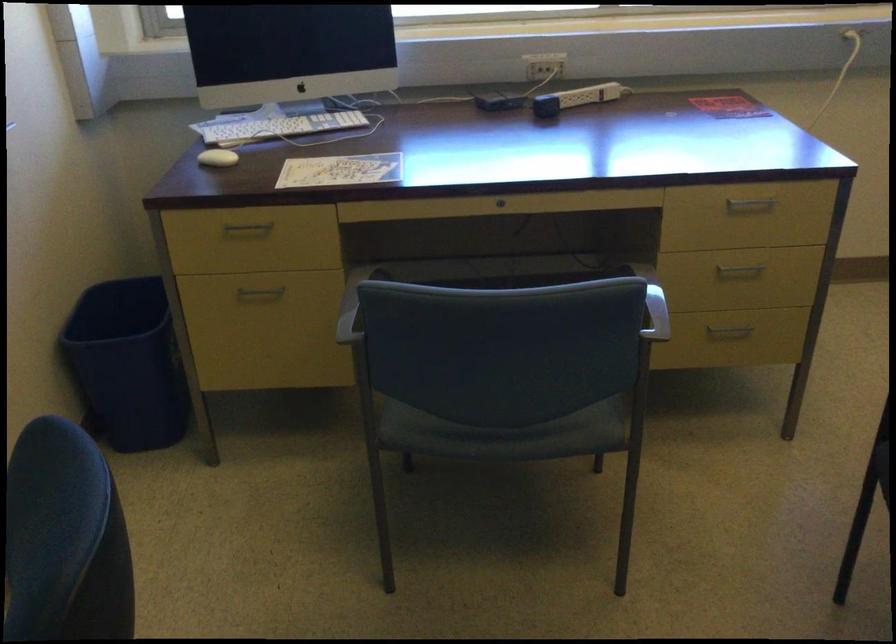
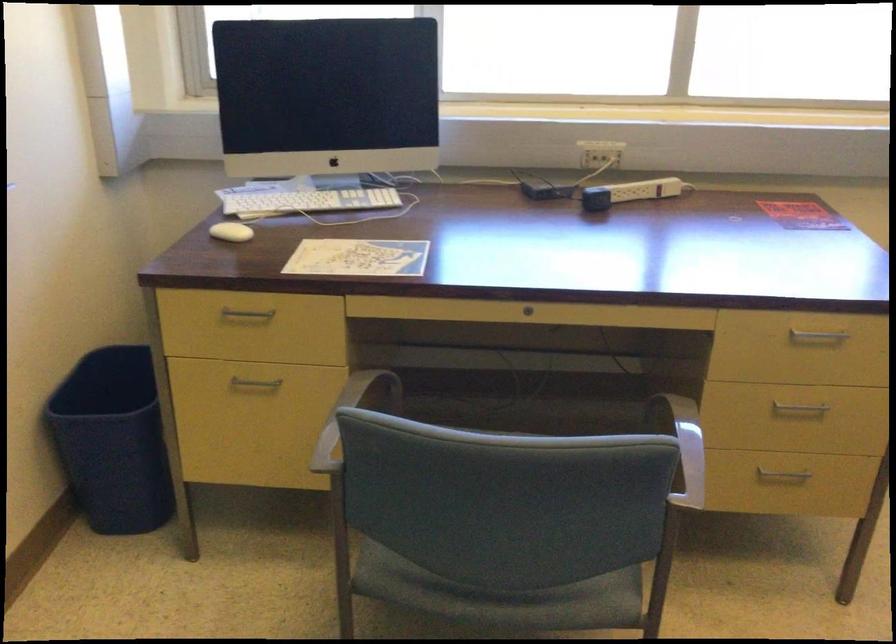
Where in the second image is the point corresponding to pixel 648 295 from the first image?

(684, 446)